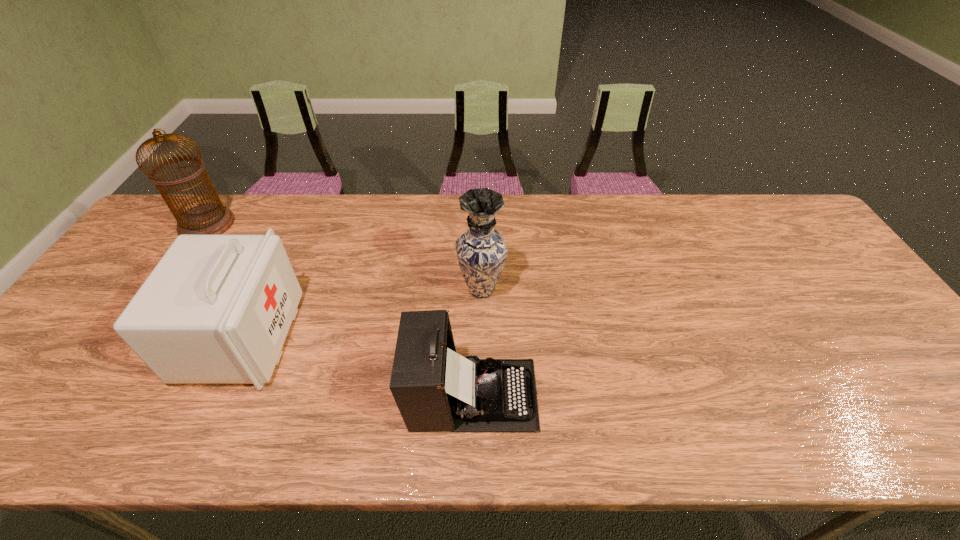
Identify the location of object at the near edge. (436, 389).

This screenshot has width=960, height=540. What are the coordinates of `object present at the left edge` in the screenshot? It's located at (211, 218).

This screenshot has width=960, height=540. I want to click on object present at the far left corner, so click(x=211, y=218).

The width and height of the screenshot is (960, 540). I want to click on free location at the far edge, so click(517, 205).

Identify the location of vacant area at the near edge of the desktop. Image resolution: width=960 pixels, height=540 pixels. (799, 430).

Where is `vacant region at the left edge of the desktop`? vacant region at the left edge of the desktop is located at coordinates (152, 266).

This screenshot has height=540, width=960. I want to click on vacant region at the near left corner of the desktop, so 26,442.

The image size is (960, 540). I want to click on free spot between the vase and the first-aid kit, so click(x=362, y=313).

I want to click on unoccupied area between the typewriter and the first-aid kit, so click(x=357, y=366).

You are a GUI agent. You are given a task and a screenshot of the screen. Output one action in this format:
    pyautogui.click(x=<x>, y=<y>)
    Task: Click on the free space between the typewriter and the first-aid kit
    This screenshot has height=540, width=960.
    Given the screenshot: What is the action you would take?
    pyautogui.click(x=357, y=366)